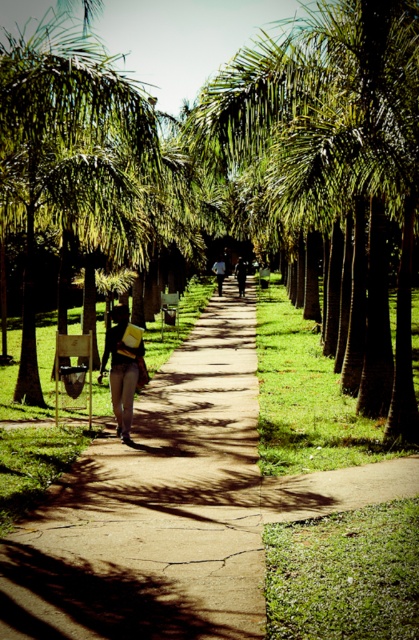
Question: Which point appears closest to the camera in this image?

Choices:
 (A) (331, 109)
 (B) (110, 336)

Answer: (A)

Question: Which of the following is the farthest from the observer?

Choices:
 (A) (129, 413)
 (B) (390, 198)
 (C) (227, 298)

Answer: (C)

Question: Is dark brown leather jacket at center closer to the viewer compared to light brown leather jacket at center?

Choices:
 (A) yes
 (B) no

Answer: (B)

Question: Does brown concrete pavement at center appear on the right side of matte yellow book at center?

Choices:
 (A) no
 (B) yes

Answer: (B)

Question: Can you confirm if brown concrete pavement at center is positioned to the left of matte yellow book at center?

Choices:
 (A) no
 (B) yes

Answer: (A)

Question: Which object is closer to the camera taking this photo?

Choices:
 (A) brown concrete pavement at center
 (B) matte yellow book at center
 (C) light brown leather jacket at center

Answer: (A)